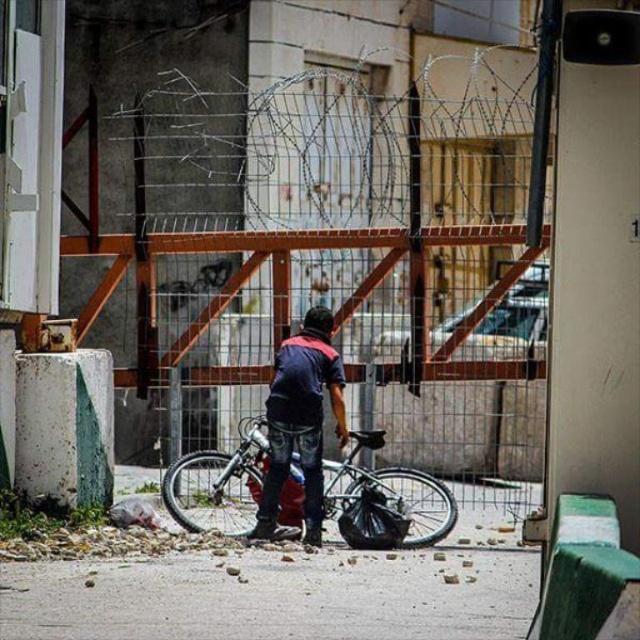
You are a delivery person trying to navigate through the scene. The metallic silver bicycle at center and the dark blue denim jeans at center are blocking your path. Which object should you move to create more space?

The metallic silver bicycle at center is bigger than the dark blue denim jeans at center, so moving the metallic silver bicycle at center would create more space.